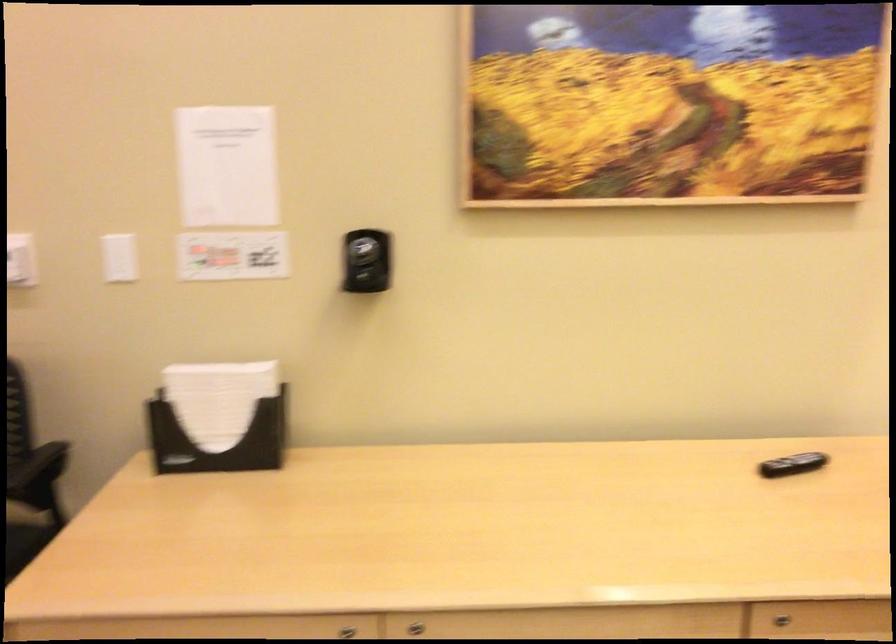
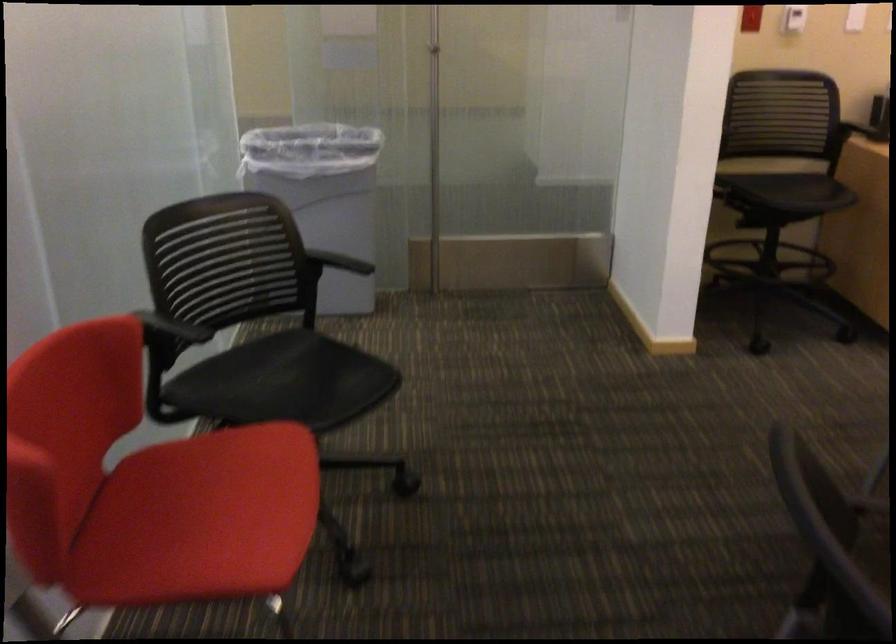
What movement of the cameraman would produce the second image?

The cameraman walked toward left, backward.